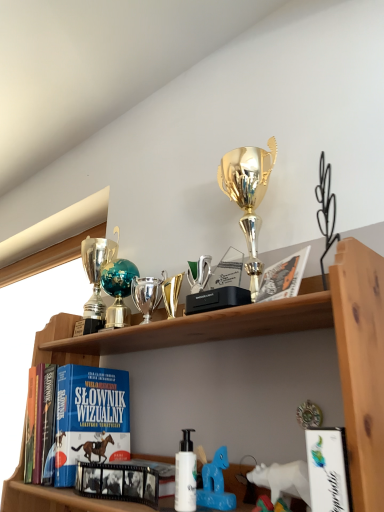
Question: Considering the relative sizes of white matte bottle at center and black glossy film strip at center, the second book viewed from the right, in the image provided, is white matte bottle at center thinner than black glossy film strip at center, the second book viewed from the right,?

Choices:
 (A) yes
 (B) no

Answer: (B)

Question: From a real-world perspective, is white matte bottle at center below black glossy film strip at center, which is counted as the second book, starting from the back?

Choices:
 (A) yes
 (B) no

Answer: (B)

Question: Can you confirm if white matte bottle at center is smaller than black glossy film strip at center, which is counted as the second book, starting from the back?

Choices:
 (A) no
 (B) yes

Answer: (B)

Question: Is white matte bottle at center taller than black glossy film strip at center, which is counted as the second book, starting from the back?

Choices:
 (A) yes
 (B) no

Answer: (A)

Question: Is white matte bottle at center in front of black glossy film strip at center, the second book viewed from the right?

Choices:
 (A) no
 (B) yes

Answer: (B)

Question: In the image, is teal glass globe at upper center, which is counted as the second toy, starting from the top, on the left side or the right side of white matte bottle at center?

Choices:
 (A) right
 (B) left

Answer: (B)

Question: Would you say teal glass globe at upper center, the 3th toy viewed from the right, is inside or outside white matte bottle at center?

Choices:
 (A) inside
 (B) outside

Answer: (B)

Question: In the image, is teal glass globe at upper center, arranged as the 1th toy when viewed from the left, positioned in front of or behind white matte bottle at center?

Choices:
 (A) behind
 (B) front

Answer: (A)

Question: From a real-world perspective, relative to white matte bottle at center, is teal glass globe at upper center, which is counted as the second toy, starting from the top, vertically above or below?

Choices:
 (A) below
 (B) above

Answer: (B)

Question: Is white matte bottle at center taller or shorter than white plastic toy horse at lower center, the first toy positioned from the front?

Choices:
 (A) tall
 (B) short

Answer: (A)

Question: Choose the correct answer: Is white matte bottle at center inside white plastic toy horse at lower center, the first toy positioned from the front, or outside it?

Choices:
 (A) inside
 (B) outside

Answer: (B)

Question: Is white matte bottle at center wider or thinner than white plastic toy horse at lower center, marked as the 1th toy in a bottom-to-top arrangement?

Choices:
 (A) wide
 (B) thin

Answer: (A)

Question: From a real-world perspective, relative to white plastic toy horse at lower center, marked as the 1th toy in a bottom-to-top arrangement, is white matte bottle at center vertically above or below?

Choices:
 (A) below
 (B) above

Answer: (B)

Question: From the image's perspective, is shiny silver trophy at center, marked as the second toy in a front-to-back arrangement, above or below white glossy book at lower right, marked as the 3th book in a back-to-front arrangement?

Choices:
 (A) above
 (B) below

Answer: (A)

Question: In terms of height, does shiny silver trophy at center, marked as the second toy in a front-to-back arrangement, look taller or shorter compared to white glossy book at lower right, the first book from the right?

Choices:
 (A) tall
 (B) short

Answer: (A)